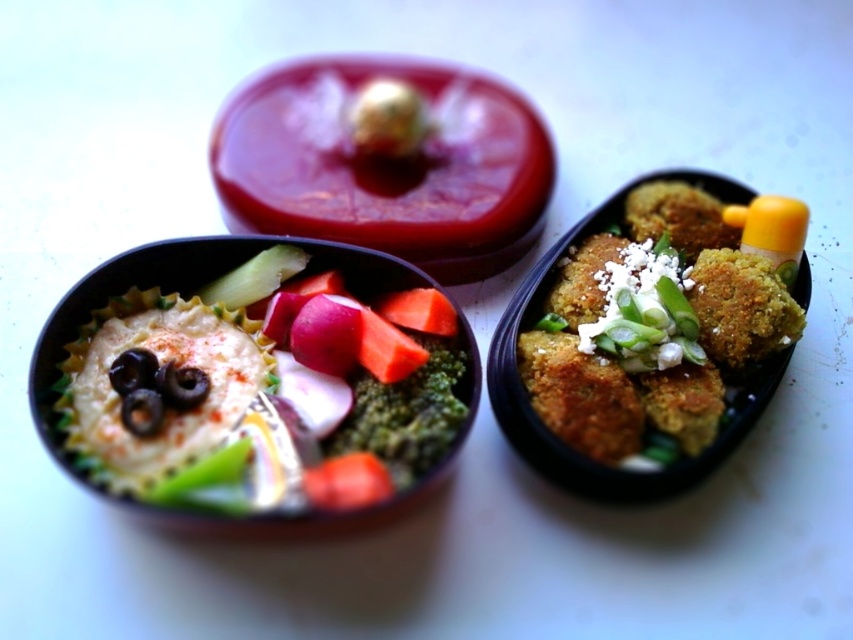
Question: Can you confirm if golden crispy balls at right is wider than green matte broccoli at center?

Choices:
 (A) no
 (B) yes

Answer: (B)

Question: Estimate the real-world distances between objects in this image. Which object is closer to the green leafytexturedsalad at left?

Choices:
 (A) golden crispy balls at right
 (B) green matte broccoli at center

Answer: (B)

Question: Where is green leafytexturedsalad at left located in relation to golden crispy balls at right in the image?

Choices:
 (A) left
 (B) right

Answer: (A)

Question: Does golden crispy balls at right have a greater width compared to green matte broccoli at center?

Choices:
 (A) no
 (B) yes

Answer: (B)

Question: Which object is positioned closest to the golden crispy balls at right?

Choices:
 (A) green leafytexturedsalad at left
 (B) green matte broccoli at center

Answer: (B)

Question: Based on their relative distances, which object is nearer to the golden crispy balls at right?

Choices:
 (A) green matte broccoli at center
 (B) green leafytexturedsalad at left

Answer: (A)